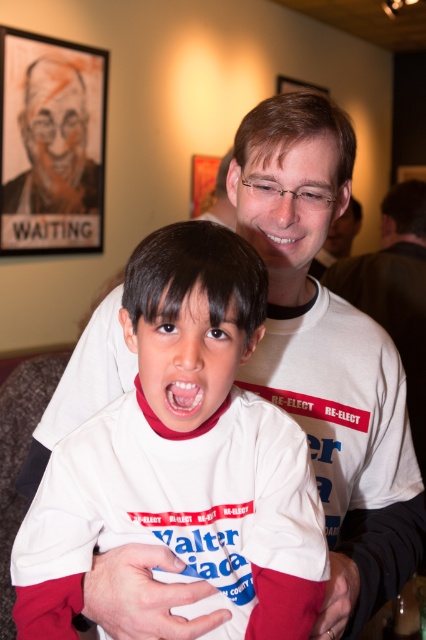
Question: Which point is farther from the camera taking this photo?

Choices:
 (A) (189, 374)
 (B) (89, 106)

Answer: (B)

Question: Which point is closer to the camera?

Choices:
 (A) (23, 221)
 (B) (319, 92)
 (C) (92, 534)

Answer: (C)

Question: Can you confirm if black paper picture frame at upper left is smaller than wooden picture frame at upper center?

Choices:
 (A) no
 (B) yes

Answer: (A)

Question: Can you confirm if white t-shirt at center is bigger than bright white teeth at center?

Choices:
 (A) yes
 (B) no

Answer: (A)

Question: Which object appears closest to the camera in this image?

Choices:
 (A) white t-shirt at center
 (B) wooden picture frame at upper center

Answer: (A)

Question: Is white t-shirt at center positioned behind bright white teeth at center?

Choices:
 (A) no
 (B) yes

Answer: (B)